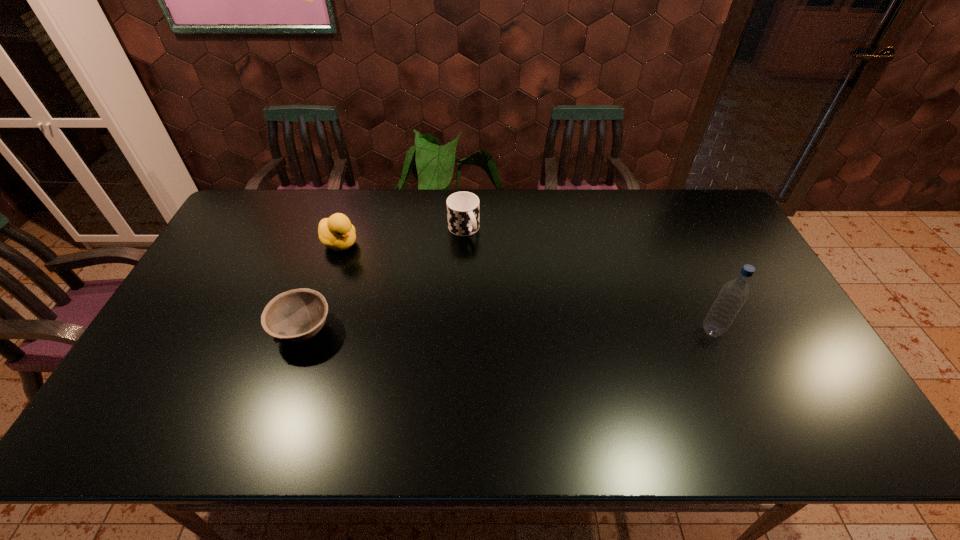
Image resolution: width=960 pixels, height=540 pixels. What are the coordinates of `vacant space situated 0.090m on the side of the third object from left to right with the handle` in the screenshot? It's located at (482, 259).

Where is `vacant position located 0.260m on the front-facing side of the third shortest object`? This screenshot has width=960, height=540. vacant position located 0.260m on the front-facing side of the third shortest object is located at coordinates (412, 286).

Identify the location of vacant space situated on the front-facing side of the third shortest object. (437, 301).

Where is `free point located on the front-facing side of the third shortest object`? The height and width of the screenshot is (540, 960). free point located on the front-facing side of the third shortest object is located at coordinates (427, 295).

Where is `object at the far edge`? object at the far edge is located at coordinates (462, 207).

This screenshot has height=540, width=960. Identify the location of vacant space at the far edge of the desktop. (292, 217).

Where is `free space at the near edge of the desktop`? free space at the near edge of the desktop is located at coordinates (621, 370).

The height and width of the screenshot is (540, 960). In order to click on blank space at the left edge in this screenshot , I will do `click(203, 335)`.

In the image, there is a desktop. In order to click on vacant space at the far right corner in this screenshot , I will do `click(696, 215)`.

Locate an element on the screen. This screenshot has height=540, width=960. free spot between the shortest object and the duck is located at coordinates (322, 287).